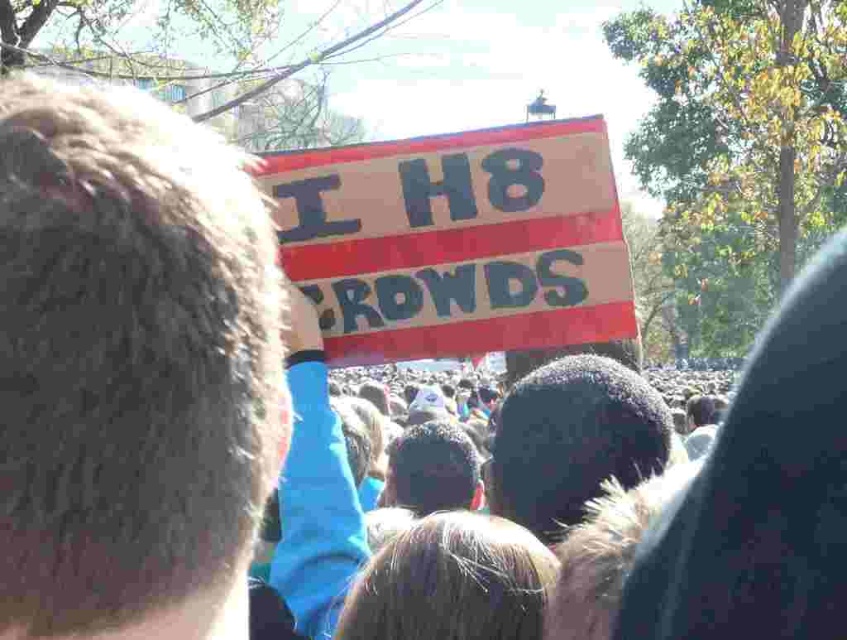
You are part of the crowd holding the wooden sign at center. You notice something brown and furry near your feet. What is the position of the brown fur at center relative to your sign?

The brown fur at center is below the wooden sign at center.

You are a photographer trying to capture a clear shot of the wooden sign at center and the brown fur at center. Which object should you focus on first if you want to ensure both are in focus without moving your camera?

The wooden sign at center is wider than brown fur at center, so focusing on the closer object first would be better. However, since the description only mentions width, not distance, it might be better to focus on the object with more detail. Alternatively, using a smaller aperture for greater depth of field could help. The given information isn